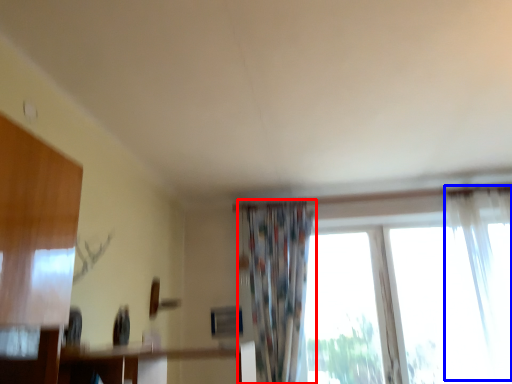
Question: Which of the following is the farthest to the observer, curtain (highlighted by a red box) or curtain (highlighted by a blue box)?

Choices:
 (A) curtain
 (B) curtain

Answer: (A)